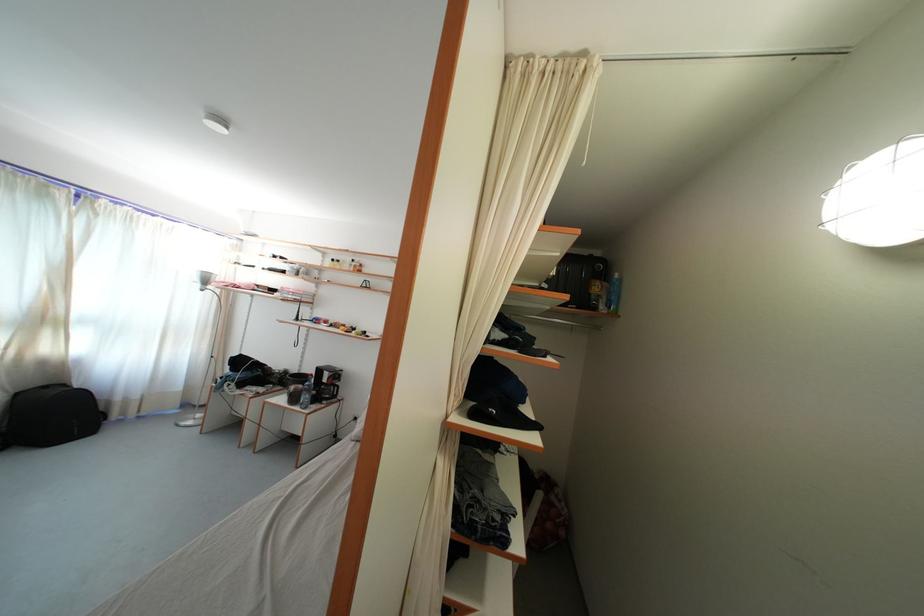
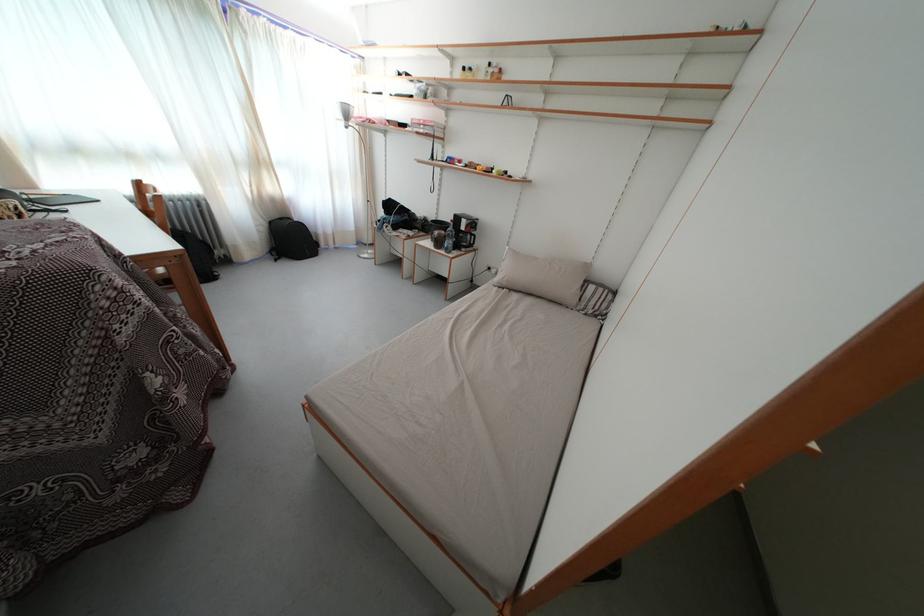
In the second image, find the point that corresponds to point (300, 405) in the first image.

(444, 249)